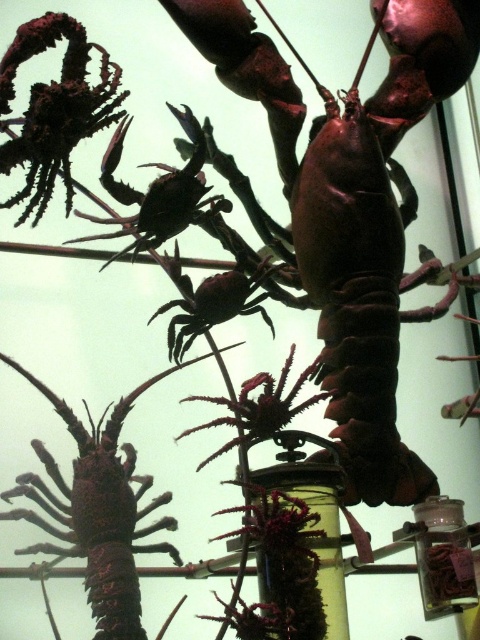
Consider the image. You are a museum visitor looking at the crustacean display. You see the brown matte lobster at upper center and the shiny brown lobster at center. Which lobster is positioned to the right of the other?

The brown matte lobster at upper center is to the right of the shiny brown lobster at center.

You are a museum curator preparing to move the brown matte lobster at upper center and the shiny brown lobster at center closer together for an exhibit. The new display requires them to be exactly 20 centimeters apart. Can you achieve this without moving any other specimens?

The current distance between the brown matte lobster at upper center and the shiny brown lobster at center is 34.18 centimeters. To reduce the gap to 20 centimeters, you would need to move them closer by 14.18 centimeters. Since there are no other specimens mentioned in the scene, this adjustment should be possible without disturbing other exhibits.